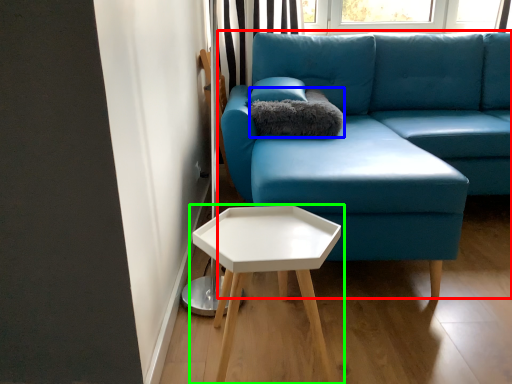
Question: Which is farther away from studio couch (highlighted by a red box)? pillow (highlighted by a blue box) or table (highlighted by a green box)?

Choices:
 (A) pillow
 (B) table

Answer: (B)